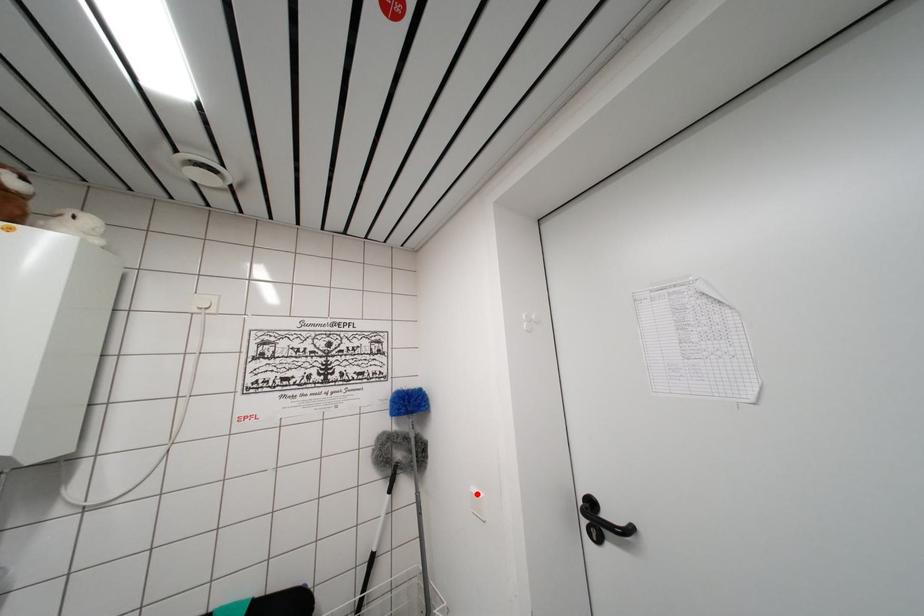
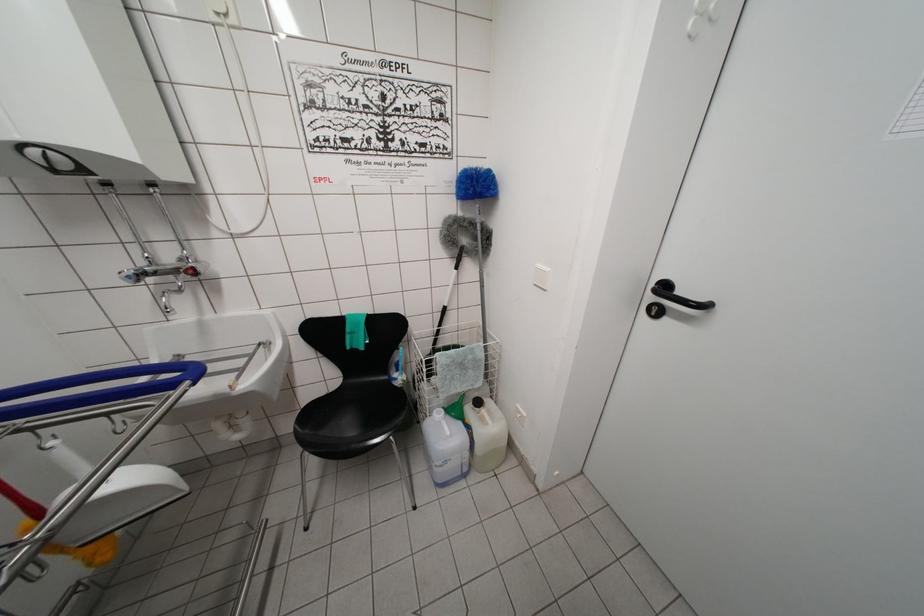
Where in the second image is the point corresponding to the highlighted location from the first image?

(542, 270)